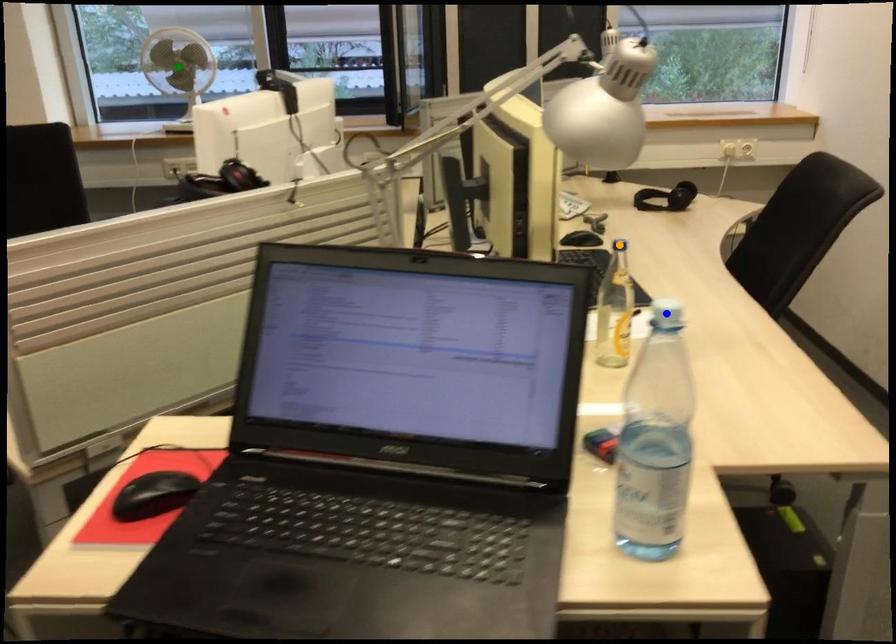
Order these from farthest to nearest:
- blue point
- orange point
- green point

green point
orange point
blue point